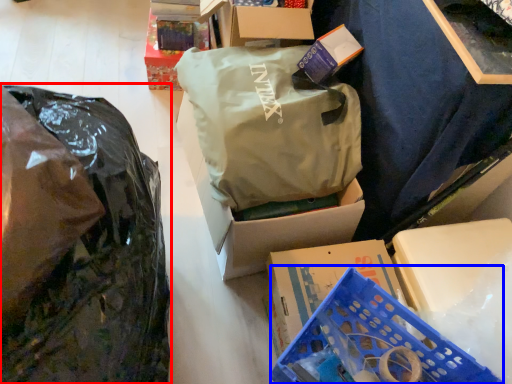
Question: Among these objects, which one is nearest to the camera, plastic bag (highlighted by a red box) or basket (highlighted by a blue box)?

Choices:
 (A) plastic bag
 (B) basket

Answer: (A)